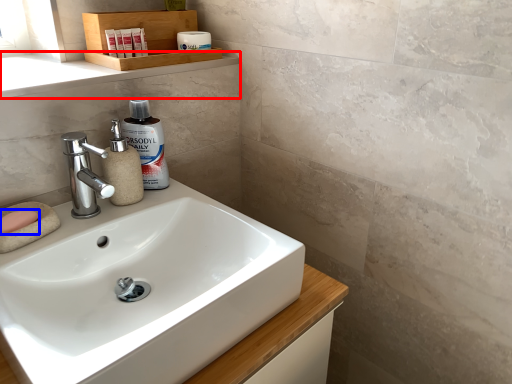
Question: Which of the following is the farthest to the observer, window sill (highlighted by a red box) or soap (highlighted by a blue box)?

Choices:
 (A) window sill
 (B) soap

Answer: (A)